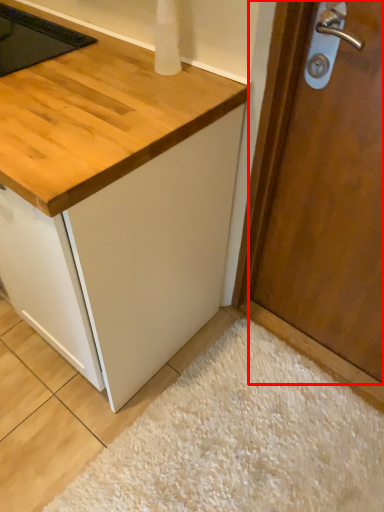
Question: From the image's perspective, where is door (annotated by the red box) located relative to plain?

Choices:
 (A) above
 (B) below

Answer: (A)